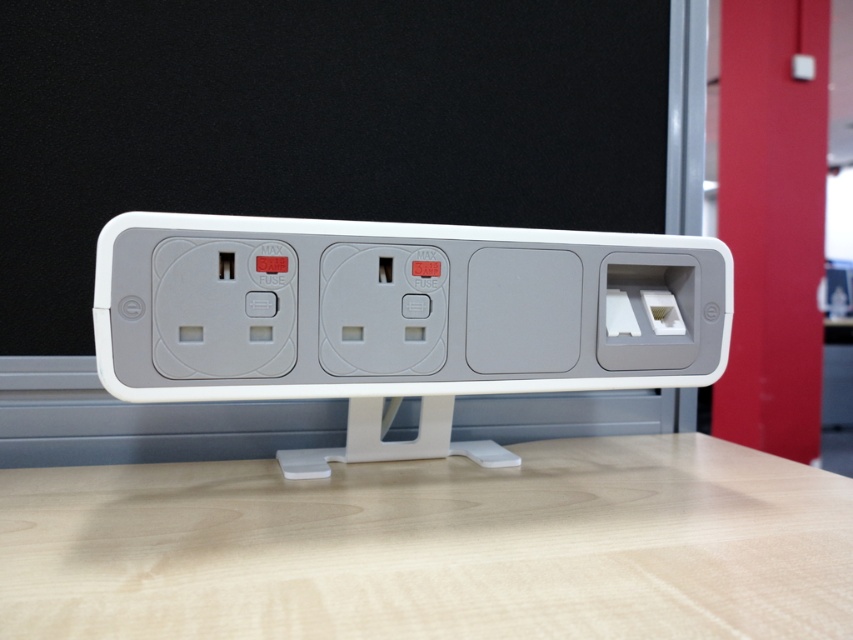
What do you see at coordinates (434, 547) in the screenshot? This screenshot has height=640, width=853. I see `light wood table at center` at bounding box center [434, 547].

You are a GUI agent. You are given a task and a screenshot of the screen. Output one action in this format:
    pyautogui.click(x=<x>, y=<y>)
    Task: Click on the light wood table at center
    
    Given the screenshot: What is the action you would take?
    pyautogui.click(x=434, y=547)